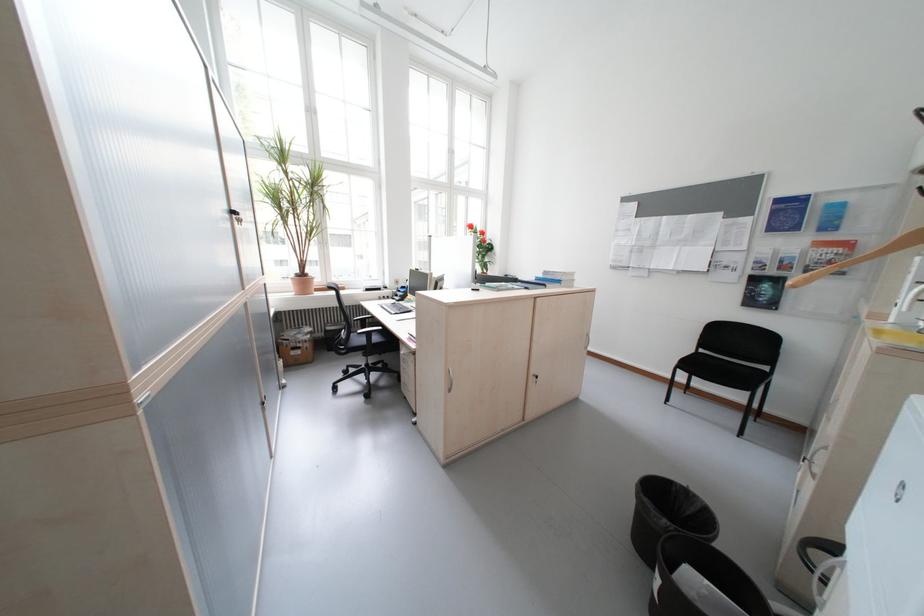
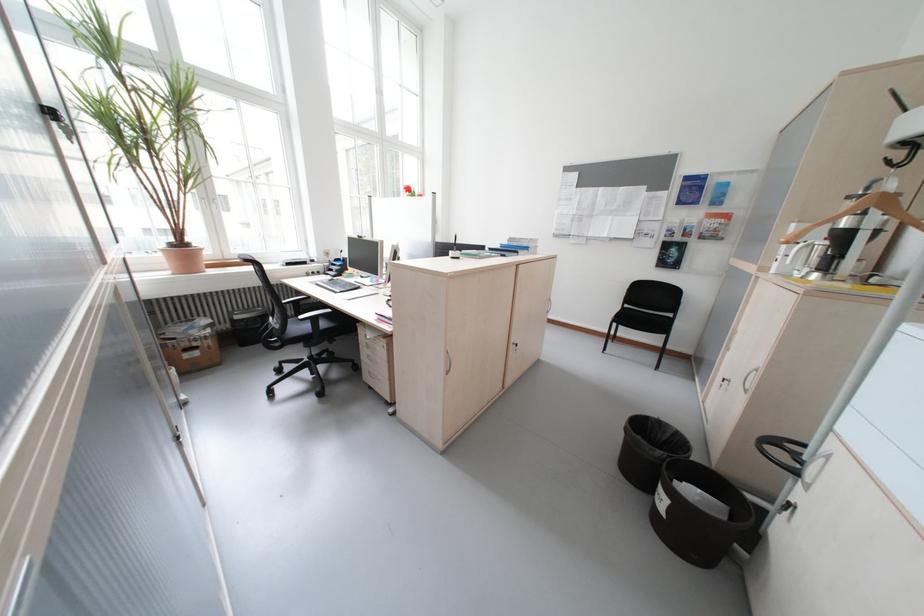
Question: Based on the continuous images, in which direction is the camera rotating? Reply with the corresponding letter.

Choices:
 (A) Left
 (B) Right
 (C) Up
 (D) Down

Answer: (B)